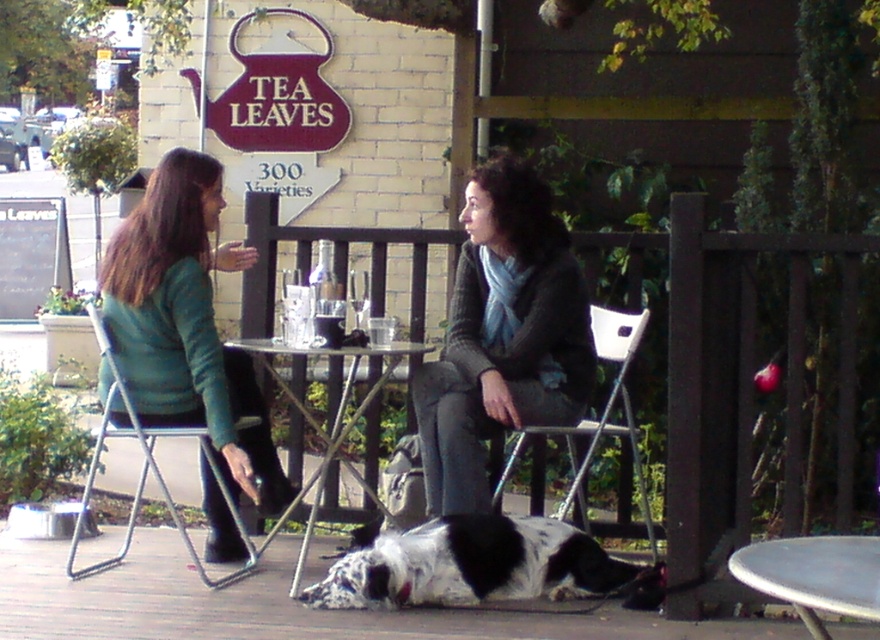
From the picture: You are a customer at the TEA LEAVES shop and want to sit down. You see the knitted gray sweater at center and the metallic silver table at center. Which object is more likely to be a seating option?

The metallic silver table at center is more likely to be a seating option because tables are typically larger than sweaters, and the knitted gray sweater at center has a smaller size compared to the metallic silver table at center.

You are sitting at the white plastic chair at center in the tea shop. You want to place your teacup on the metallic silver table at lower right. Can you reach it without moving from your seat?

The metallic silver table at lower right is to the right of the white plastic chair at center, so yes, you can reach it without moving from your seat.